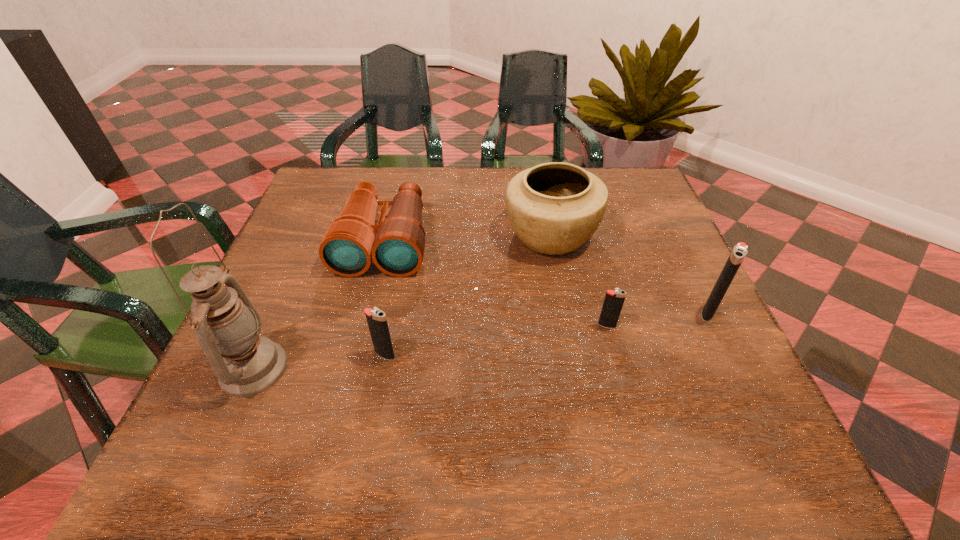
Where is `free space between the shortest igniter and the pottery`? This screenshot has width=960, height=540. free space between the shortest igniter and the pottery is located at coordinates (579, 280).

The width and height of the screenshot is (960, 540). Identify the location of object that ranks as the fourth closest to the pottery. (376, 318).

The width and height of the screenshot is (960, 540). I want to click on object that can be found as the closest to the leftmost object, so click(x=376, y=318).

Locate an element on the screen. igniter that is the closest one to the pottery is located at coordinates (614, 300).

Point out which igniter is positioned as the third nearest to the binoculars. Please provide its 2D coordinates. Your answer should be formatted as a tuple, i.e. [(x, y)], where the tuple contains the x and y coordinates of a point satisfying the conditions above.

[(739, 251)]

This screenshot has width=960, height=540. In order to click on free location that satisfies the following two spatial constraints: 1. on the back side of the nearest igniter; 2. on the right side of the oil lamp in this screenshot , I will do `click(260, 355)`.